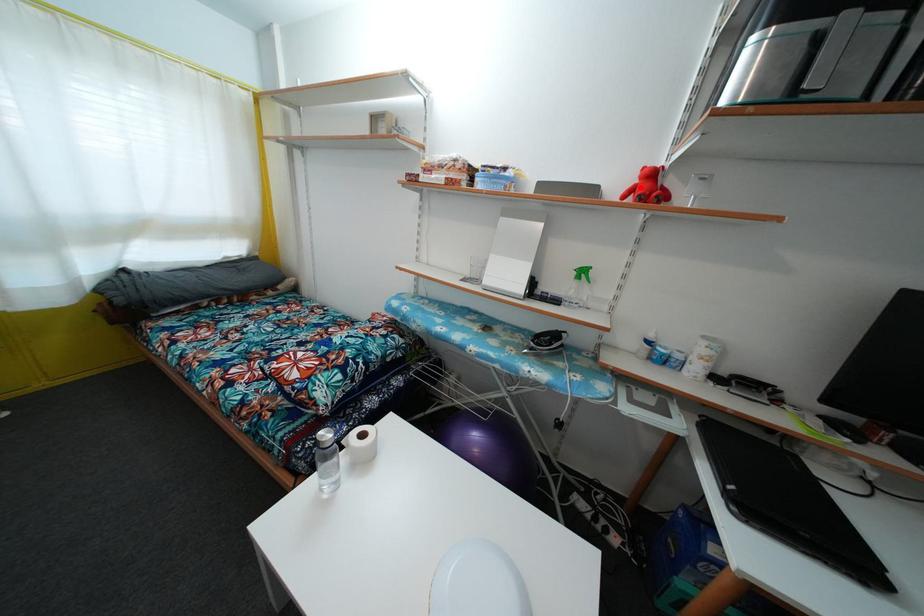
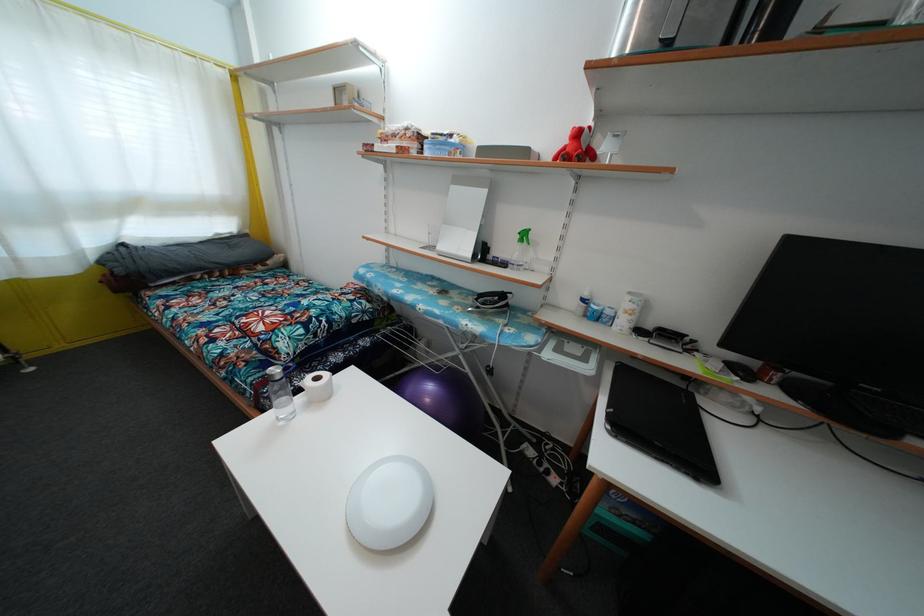
Where in the second image is the point corresponding to the highlighted location from the first image?

(570, 148)